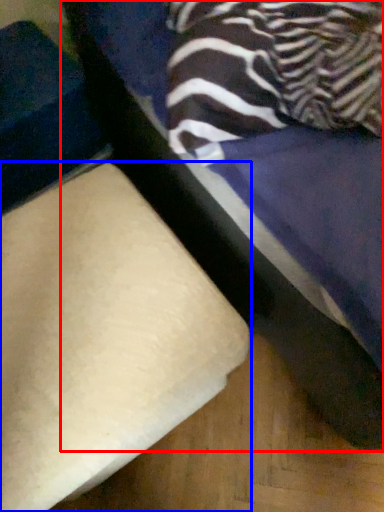
Question: Which of the following is the farthest to the observer, furniture (highlighted by a red box) or furniture (highlighted by a blue box)?

Choices:
 (A) furniture
 (B) furniture

Answer: (B)